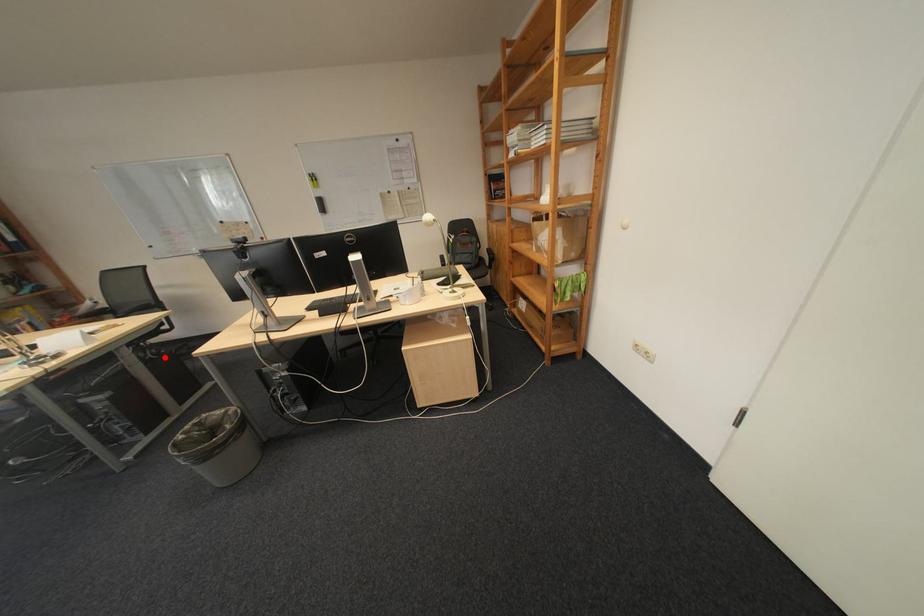
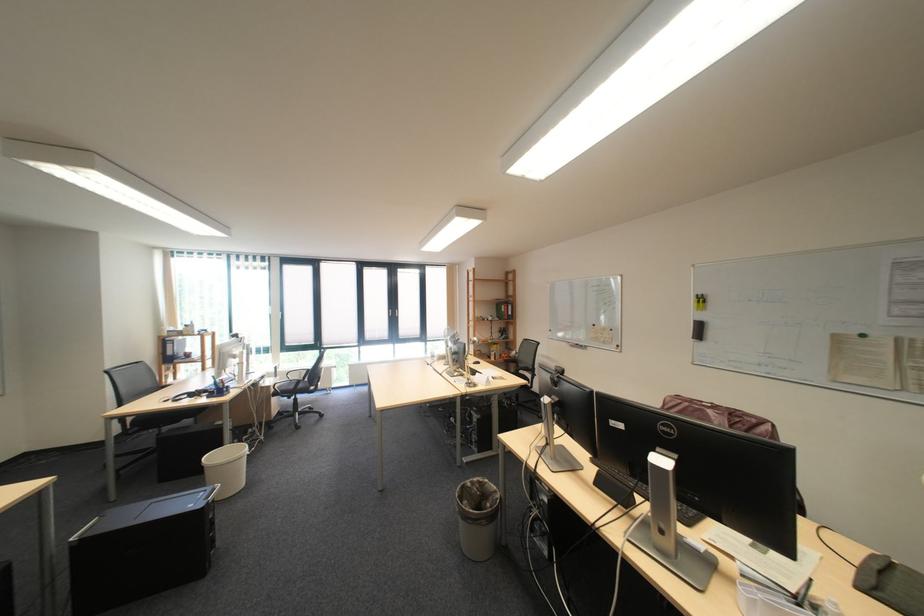
Question: I am providing you with two images of the same scene from different viewpoints. A red point is marked on the first image. Is the red point's position out of view in image 2?

Choices:
 (A) Yes
 (B) No

Answer: (B)